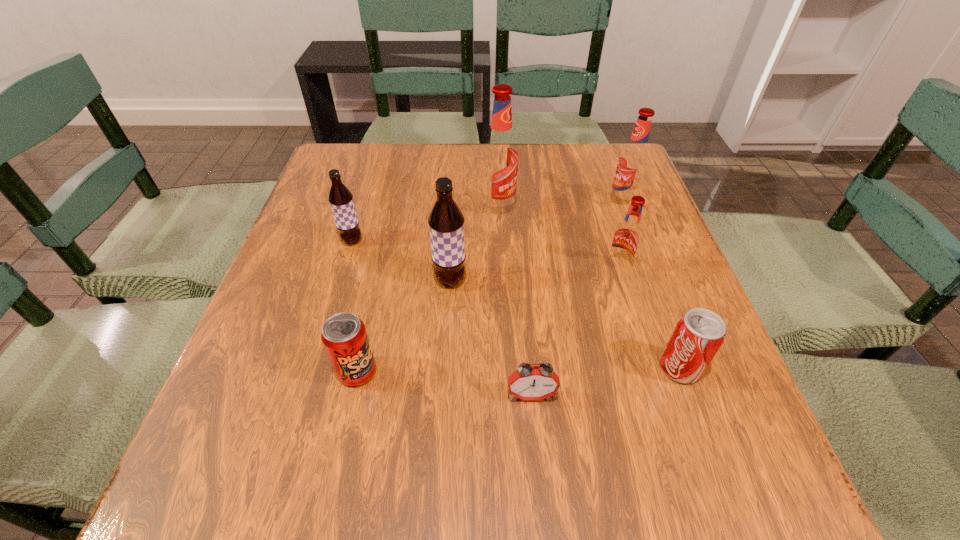
You are a GUI agent. You are given a task and a screenshot of the screen. Output one action in this format:
    pyautogui.click(x=<x>, y=<y>)
    Task: Click on the second closest root beer to the right soda can
    
    Given the screenshot: What is the action you would take?
    pyautogui.click(x=446, y=222)

Locate an element on the screen. This screenshot has width=960, height=540. red root beer that is the third closest one to the second object from left to right is located at coordinates (x=633, y=161).

Locate which red root beer is the second closest to the rightmost red root beer. Please provide its 2D coordinates. Your answer should be formatted as a tuple, i.e. [(x, y)], where the tuple contains the x and y coordinates of a point satisfying the conditions above.

[(499, 160)]

Find the location of a particular element. The width and height of the screenshot is (960, 540). vacant space that satisfies the following two spatial constraints: 1. on the back side of the left red soda can; 2. on the right side of the right red soda can is located at coordinates (358, 368).

I want to click on free space that satisfies the following two spatial constraints: 1. on the front side of the leftmost object; 2. on the right side of the left soda can, so click(312, 372).

Where is `vacant area that satisfies the following two spatial constraints: 1. on the front side of the right soda can; 2. on the right side of the second red root beer from left to right`? vacant area that satisfies the following two spatial constraints: 1. on the front side of the right soda can; 2. on the right side of the second red root beer from left to right is located at coordinates (648, 368).

This screenshot has width=960, height=540. Find the location of `vacant area in the image that satisfies the following two spatial constraints: 1. on the front side of the leftmost object; 2. on the right side of the seventh object from right to left`. vacant area in the image that satisfies the following two spatial constraints: 1. on the front side of the leftmost object; 2. on the right side of the seventh object from right to left is located at coordinates (312, 372).